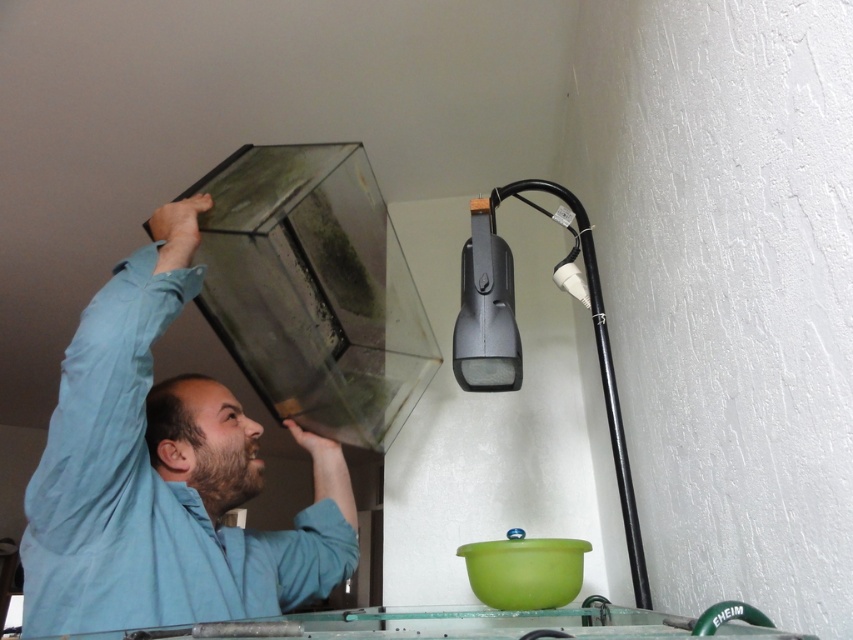
Question: Does blue cotton shirt at upper left have a larger size compared to black plastic lamp at upper right?

Choices:
 (A) yes
 (B) no

Answer: (A)

Question: Is blue cotton shirt at upper left further to the viewer compared to black plastic lamp at upper right?

Choices:
 (A) no
 (B) yes

Answer: (A)

Question: Is blue cotton shirt at upper left in front of black plastic lamp at upper right?

Choices:
 (A) no
 (B) yes

Answer: (B)

Question: Which of the following is the farthest from the observer?

Choices:
 (A) (204, 451)
 (B) (512, 308)

Answer: (A)